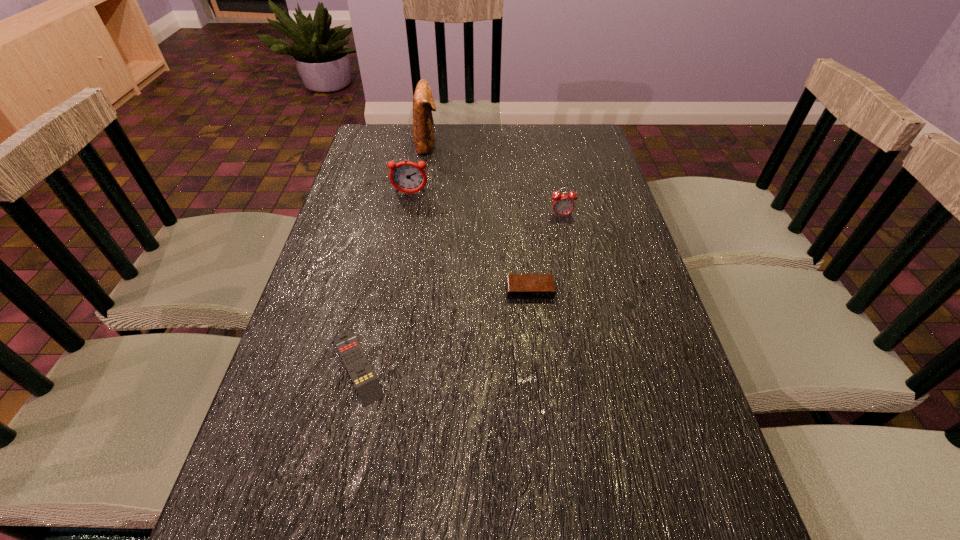
The width and height of the screenshot is (960, 540). Identify the location of the farthest object. (423, 102).

What are the coordinates of `the tallest object` in the screenshot? It's located at (423, 102).

Where is `the leftmost alarm clock`? The width and height of the screenshot is (960, 540). the leftmost alarm clock is located at coordinates (408, 177).

Identify the location of the farthest alarm clock. The width and height of the screenshot is (960, 540). (408, 177).

The height and width of the screenshot is (540, 960). I want to click on the second shortest alarm clock, so click(563, 204).

The width and height of the screenshot is (960, 540). Identify the location of the third nearest object. (563, 204).

Where is `the second alarm clock from right to left`? The width and height of the screenshot is (960, 540). the second alarm clock from right to left is located at coordinates (519, 286).

Find the location of a particular element. The image size is (960, 540). the nearest alarm clock is located at coordinates (519, 286).

The width and height of the screenshot is (960, 540). In order to click on remote control in this screenshot , I will do `click(362, 375)`.

The image size is (960, 540). In order to click on free point located 0.070m on the open side of the farthest object in this screenshot , I will do `click(459, 144)`.